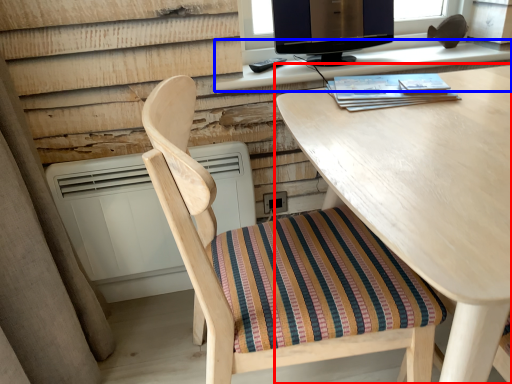
Question: Which of the following is the closest to the observer, desk (highlighted by a red box) or computer desk (highlighted by a blue box)?

Choices:
 (A) desk
 (B) computer desk

Answer: (A)